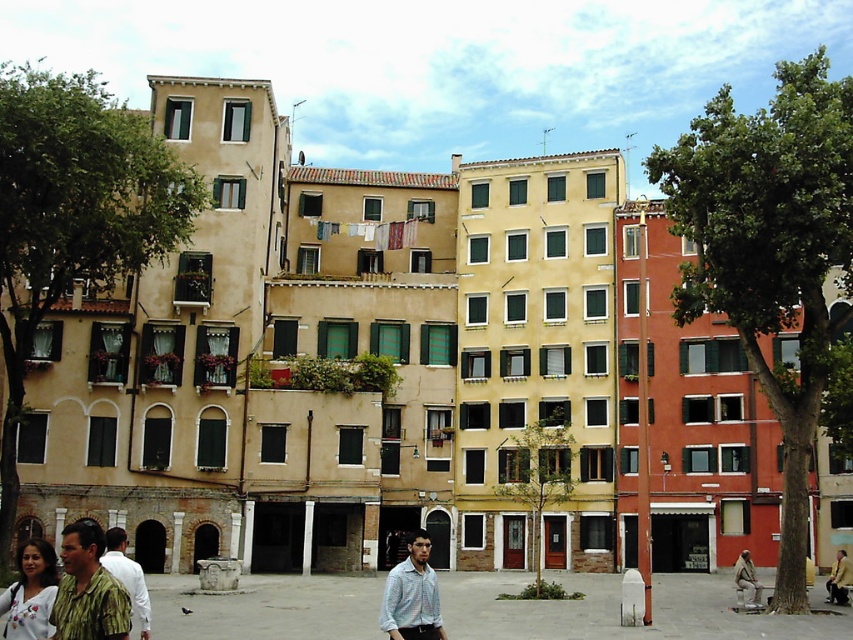
Question: Which of the following is the farthest from the observer?

Choices:
 (A) white embroidered blouse at lower left
 (B) green floral shirt at lower left
 (C) yellow leather jacket at lower right
 (D) light blue shirt at center

Answer: (C)

Question: Is light blue shirt at center closer to the viewer compared to white embroidered blouse at lower left?

Choices:
 (A) yes
 (B) no

Answer: (B)

Question: Which of the following is the farthest from the observer?

Choices:
 (A) yellow leather jacket at lower right
 (B) green floral shirt at lower left
 (C) light brown fabric at lower right
 (D) white embroidered blouse at lower left

Answer: (A)

Question: Is light brown fabric at lower right above yellow leather jacket at lower right?

Choices:
 (A) yes
 (B) no

Answer: (B)

Question: Is green floral shirt at lower left to the left of white embroidered blouse at lower left from the viewer's perspective?

Choices:
 (A) no
 (B) yes

Answer: (A)

Question: Estimate the real-world distances between objects in this image. Which object is farther from the white embroidered blouse at lower left?

Choices:
 (A) light brown fabric at lower right
 (B) camouflage shirt at lower left
 (C) yellow leather jacket at lower right
 (D) green floral shirt at lower left

Answer: (C)